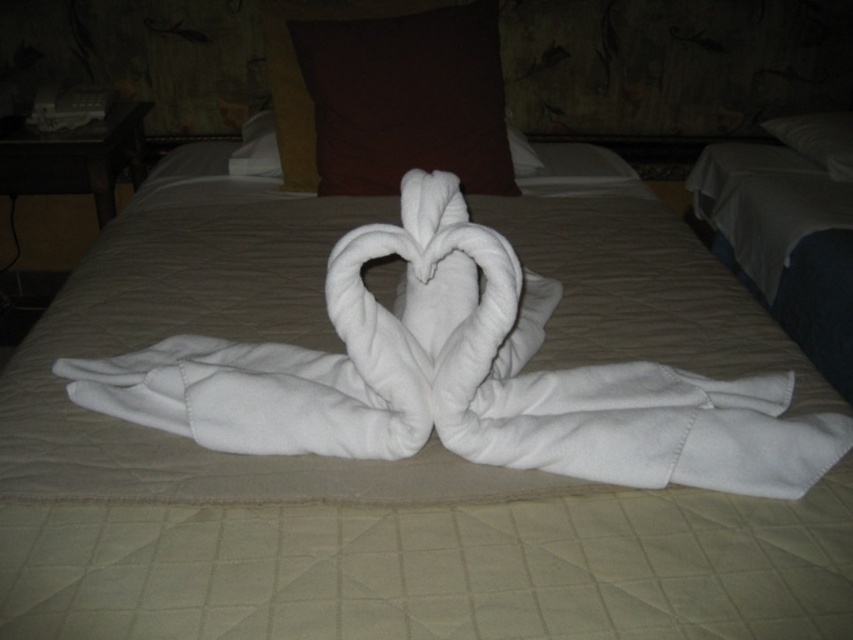
Question: Based on their relative distances, which object is nearer to the brown fabric pillow at upper center?

Choices:
 (A) white soft pillow at upper center
 (B) white towel at center

Answer: (B)

Question: Does brown fabric pillow at upper center appear over white soft pillow at upper center?

Choices:
 (A) yes
 (B) no

Answer: (B)

Question: Is brown fabric pillow at upper center to the right of white soft pillow at upper center from the viewer's perspective?

Choices:
 (A) yes
 (B) no

Answer: (B)

Question: Estimate the real-world distances between objects in this image. Which object is closer to the brown fabric pillow at upper center?

Choices:
 (A) white towel at center
 (B) white soft pillow at upper center

Answer: (A)

Question: Can you confirm if white towel at center is thinner than brown fabric pillow at upper center?

Choices:
 (A) no
 (B) yes

Answer: (A)

Question: Estimate the real-world distances between objects in this image. Which object is farther from the white soft pillow at upper center?

Choices:
 (A) brown fabric pillow at upper center
 (B) white towel at center

Answer: (B)